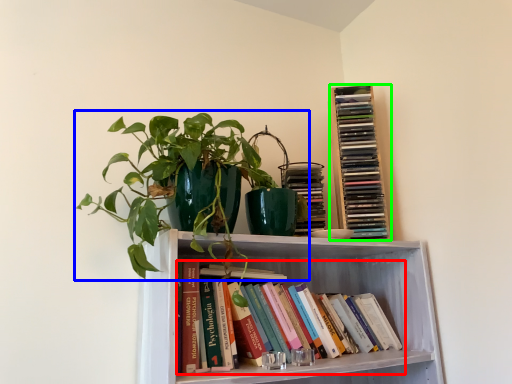
Question: Considering the real-world distances, which object is closest to book (highlighted by a red box)? houseplant (highlighted by a blue box) or book (highlighted by a green box).

Choices:
 (A) houseplant
 (B) book

Answer: (B)